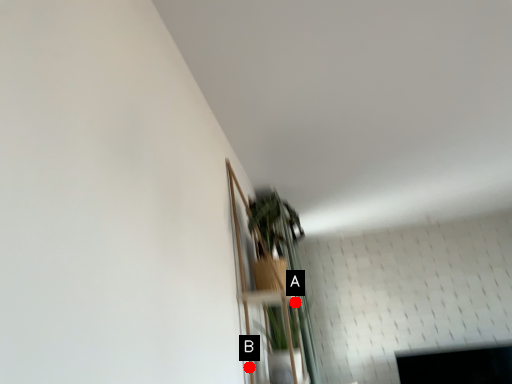
Question: Two points are circled on the image, labeled by A and B beside each circle. Which of the following is the closest to the observer?

Choices:
 (A) A is closer
 (B) B is closer

Answer: (B)